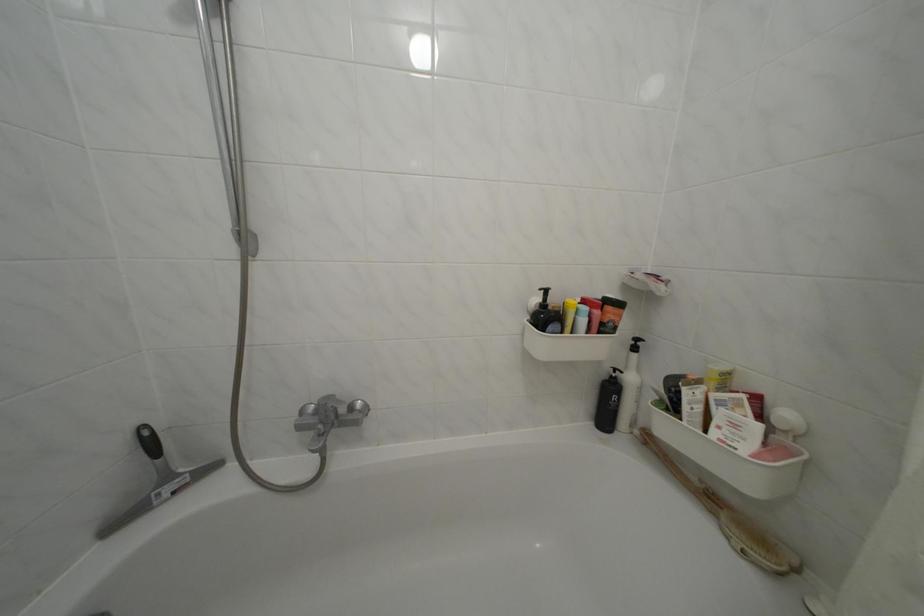
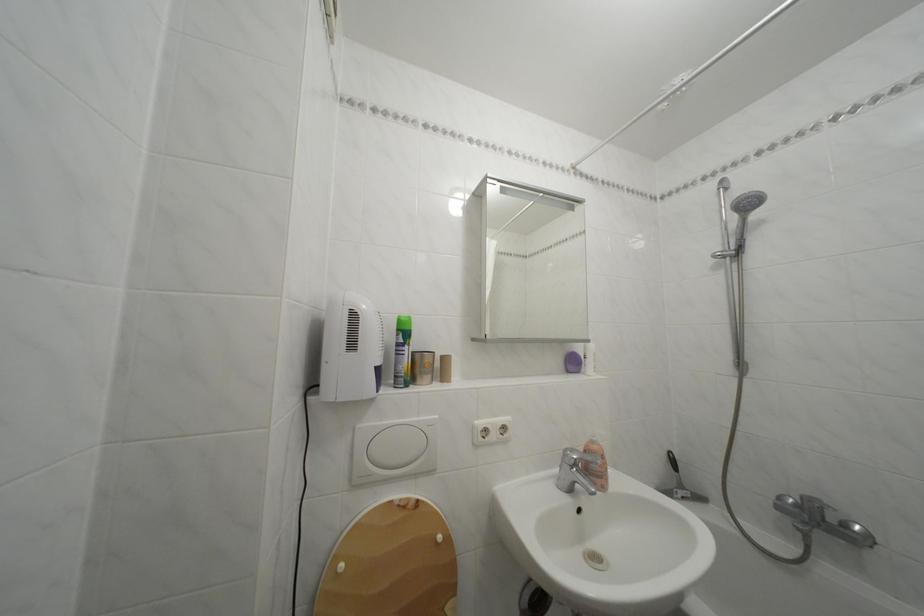
Locate, in the second image, the point that corresponds to [324,418] in the first image.

(806, 512)